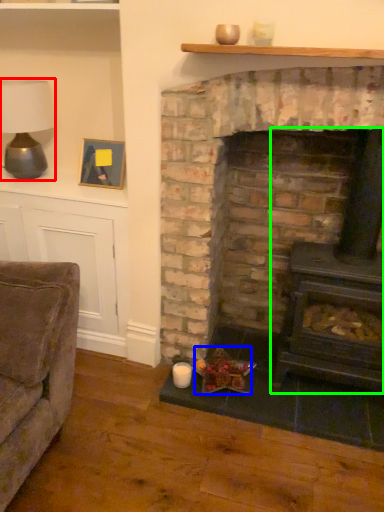
Question: Which object is the closest to the table lamp (highlighted by a red box)? Choose among these: food (highlighted by a blue box) or wood burning stove (highlighted by a green box).

Choices:
 (A) food
 (B) wood burning stove

Answer: (A)